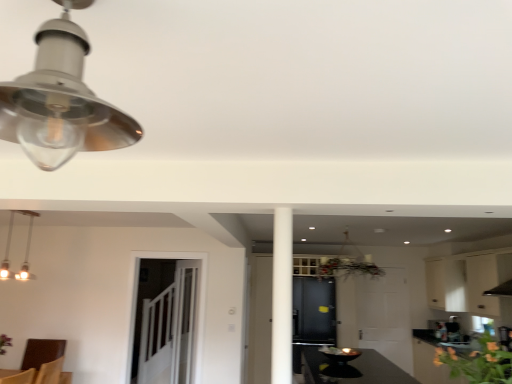
Question: In terms of height, does white matte cabinet at upper right, the first cabinetry when ordered from right to left, look taller or shorter compared to green leafy plant at lower right?

Choices:
 (A) tall
 (B) short

Answer: (A)

Question: From a real-world perspective, is white matte cabinet at upper right, the first cabinetry when ordered from right to left, positioned above or below green leafy plant at lower right?

Choices:
 (A) above
 (B) below

Answer: (A)

Question: Which object is the farthest from the white matte cabinet at upper right, which appears as the second cabinetry when viewed from the left?

Choices:
 (A) matte silver lampshade at upper left, the 2th lamp positioned from the left
 (B) clear glass door at center
 (C) green leafy plant at lower right
 (D) white glossy pendant light at upper left, which is the 1th lamp from bottom to top
 (E) matte black cabinet at center, the second cabinetry positioned from the right

Answer: (A)

Question: Which object is the closest to the matte silver lampshade at upper left, the 1th lamp from the top?

Choices:
 (A) white glossy pendant light at upper left, which is the first lamp in left-to-right order
 (B) matte black cabinet at center, the second cabinetry positioned from the right
 (C) green leafy plant at lower right
 (D) clear glass door at center
 (E) white matte cabinet at upper right, which appears as the second cabinetry when viewed from the left

Answer: (C)